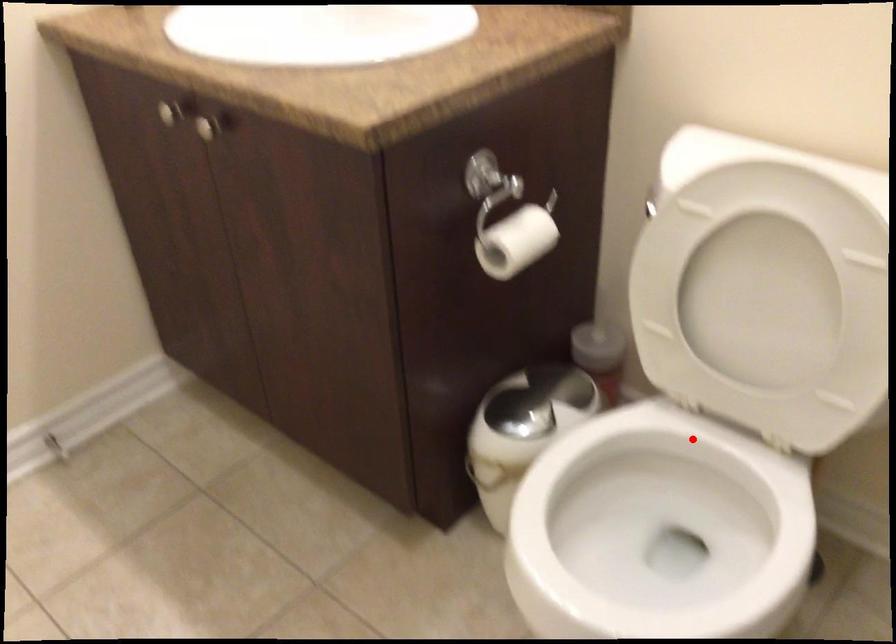
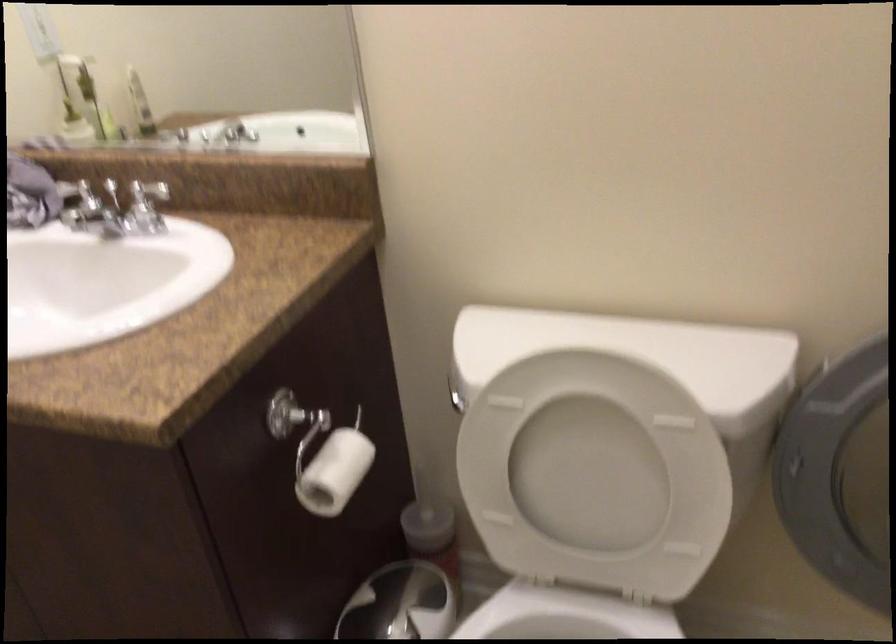
Question: I am providing you with two images of the same scene from different viewpoints. A red point is marked on the first image. Can you still see the location of the red point in image 2?

Choices:
 (A) Yes
 (B) No

Answer: (A)